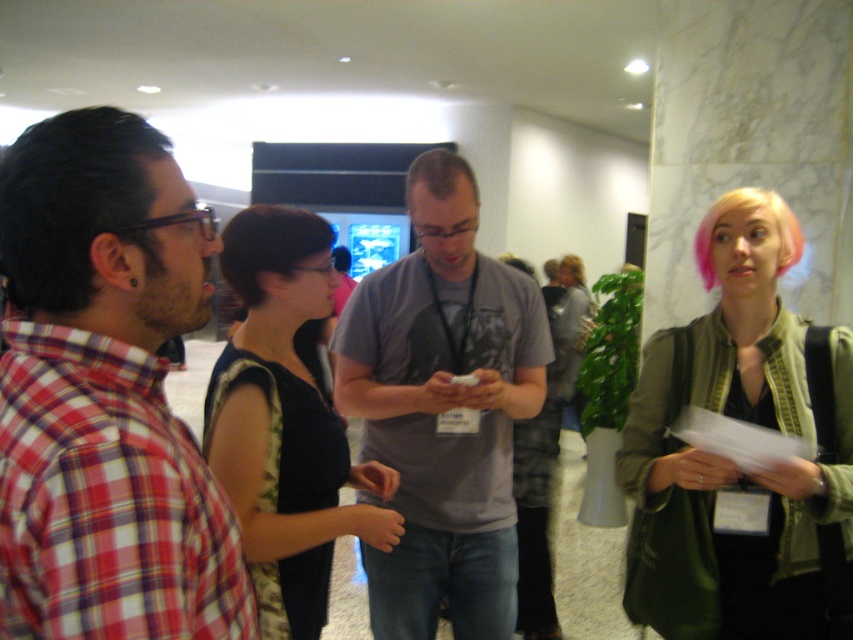
Can you confirm if blonde hair at upper right is positioned to the left of pink matte hair at upper right?

Indeed, blonde hair at upper right is positioned on the left side of pink matte hair at upper right.

Which is in front, point (746, 324) or point (566, 273)?

Positioned in front is point (746, 324).

Measure the distance between point (781,417) and camera.

A distance of 1.47 meters exists between point (781,417) and camera.

You are a GUI agent. You are given a task and a screenshot of the screen. Output one action in this format:
    pyautogui.click(x=<x>, y=<y>)
    Task: Click on the blonde hair at upper right
    
    Given the screenshot: What is the action you would take?
    pyautogui.click(x=741, y=461)

Can you confirm if gray matte t-shirt at center is taller than black shiny hair at center?

Yes, gray matte t-shirt at center is taller than black shiny hair at center.

Does gray matte t-shirt at center appear over black shiny hair at center?

Incorrect, gray matte t-shirt at center is not positioned above black shiny hair at center.

Locate an element on the screen. This screenshot has width=853, height=640. gray matte t-shirt at center is located at coordinates click(444, 419).

Can you confirm if black shiny hair at center is positioned below pink dyed hair at upper right?

Correct, black shiny hair at center is located below pink dyed hair at upper right.

Does black shiny hair at center appear over pink dyed hair at upper right?

No.

Measure the distance between black shiny hair at center and camera.

A distance of 3.77 feet exists between black shiny hair at center and camera.

Identify the location of black shiny hair at center. This screenshot has height=640, width=853. (268, 244).